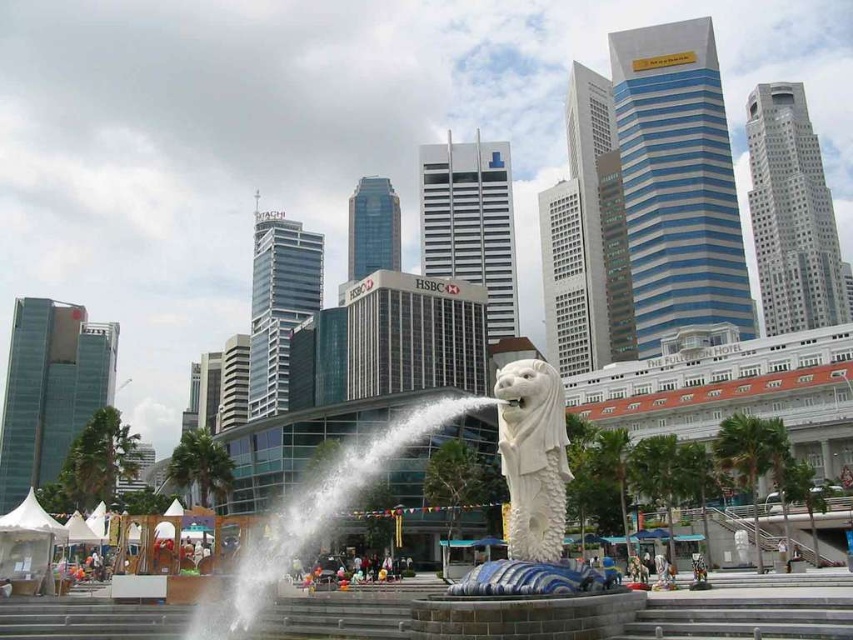
Can you confirm if white marble merlion at center is bigger than white stone merlion at center?

Indeed, white marble merlion at center has a larger size compared to white stone merlion at center.

Is point (527, 387) more distant than point (560, 390)?

No, it is not.

In order to click on white marble merlion at center in this screenshot , I will do `click(532, 492)`.

Can you confirm if white water at center is positioned to the left of white stone merlion at center?

Correct, you'll find white water at center to the left of white stone merlion at center.

Which is above, white water at center or white stone merlion at center?

white stone merlion at center is higher up.

You are a GUI agent. You are given a task and a screenshot of the screen. Output one action in this format:
    pyautogui.click(x=<x>, y=<y>)
    Task: Click on the white water at center
    Image resolution: width=853 pixels, height=640 pixels.
    Given the screenshot: What is the action you would take?
    pyautogui.click(x=312, y=516)

Which is below, white marble merlion at center or white water at center?

white water at center is lower down.

Does white marble merlion at center have a larger size compared to white water at center?

Incorrect, white marble merlion at center is not larger than white water at center.

Who is more distant from viewer, (514,406) or (341,444)?

Point (341,444)

This screenshot has width=853, height=640. Find the location of `white marble merlion at center`. white marble merlion at center is located at coordinates (532, 492).